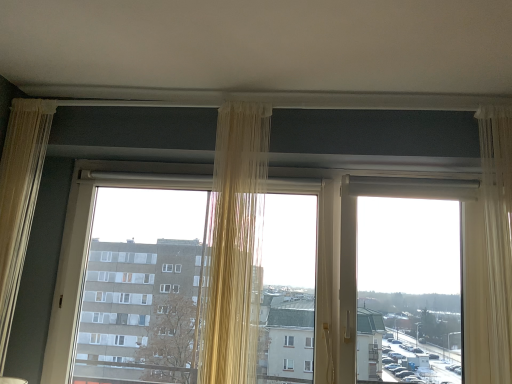
Question: Is translucent beige curtain at center, positioned as the 2th curtain in right-to-left order, positioned before sheer beige curtain at left, the 3th curtain positioned from the right?

Choices:
 (A) no
 (B) yes

Answer: (B)

Question: From a real-world perspective, is translucent beige curtain at center, positioned as the 2th curtain in right-to-left order, under sheer beige curtain at left, the 3th curtain positioned from the right?

Choices:
 (A) yes
 (B) no

Answer: (B)

Question: Is translucent beige curtain at center, the second curtain positioned from the left, oriented away from sheer beige curtain at left, the 1th curtain from the left?

Choices:
 (A) no
 (B) yes

Answer: (A)

Question: Would you say translucent beige curtain at center, positioned as the 2th curtain in right-to-left order, is outside sheer beige curtain at left, the 3th curtain positioned from the right?

Choices:
 (A) yes
 (B) no

Answer: (A)

Question: Does translucent beige curtain at center, the second curtain positioned from the left, have a smaller size compared to sheer beige curtain at left, the 3th curtain positioned from the right?

Choices:
 (A) no
 (B) yes

Answer: (A)

Question: Does translucent fabric at center have a greater width compared to sheer beige curtain at left, the 3th curtain positioned from the right?

Choices:
 (A) yes
 (B) no

Answer: (A)

Question: Is translucent fabric at center aimed at sheer beige curtain at left, the 3th curtain positioned from the right?

Choices:
 (A) yes
 (B) no

Answer: (A)

Question: Is translucent fabric at center positioned in front of sheer beige curtain at left, the 1th curtain from the left?

Choices:
 (A) no
 (B) yes

Answer: (A)

Question: Would you say translucent fabric at center is outside sheer beige curtain at left, the 1th curtain from the left?

Choices:
 (A) no
 (B) yes

Answer: (B)

Question: Is translucent fabric at center shorter than sheer beige curtain at left, the 1th curtain from the left?

Choices:
 (A) yes
 (B) no

Answer: (A)

Question: From a real-world perspective, is translucent fabric at center physically above sheer beige curtain at left, the 1th curtain from the left?

Choices:
 (A) no
 (B) yes

Answer: (A)

Question: From the image's perspective, is sheer beige curtain at left, the 1th curtain from the left, located beneath translucent fabric at center?

Choices:
 (A) no
 (B) yes

Answer: (A)